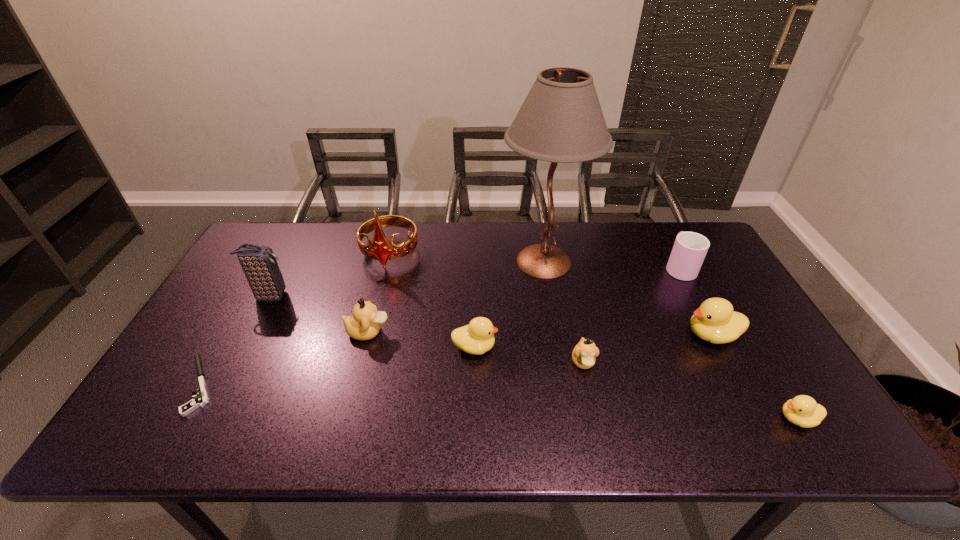
The image size is (960, 540). I want to click on the tallest object, so click(x=561, y=121).

Identify the location of tiara. (381, 249).

The width and height of the screenshot is (960, 540). Find the location of `the second tallest object`. the second tallest object is located at coordinates (381, 249).

Where is `clutch bag`? The image size is (960, 540). clutch bag is located at coordinates (259, 264).

Find the location of a particular element. The height and width of the screenshot is (540, 960). the biggest yellow duckling is located at coordinates (714, 321).

You are a GUI agent. You are given a task and a screenshot of the screen. Output one action in this format:
    pyautogui.click(x=<x>, y=<y>)
    Task: Click on the cup
    
    Given the screenshot: What is the action you would take?
    pyautogui.click(x=690, y=248)

The height and width of the screenshot is (540, 960). Identify the location of the left tan duckling. click(365, 323).

The width and height of the screenshot is (960, 540). I want to click on the farther tan duckling, so click(x=365, y=323).

What are the coordinates of `the leftmost yellow duckling` in the screenshot? It's located at (478, 337).

I want to click on the sixth object from right to left, so click(x=478, y=337).